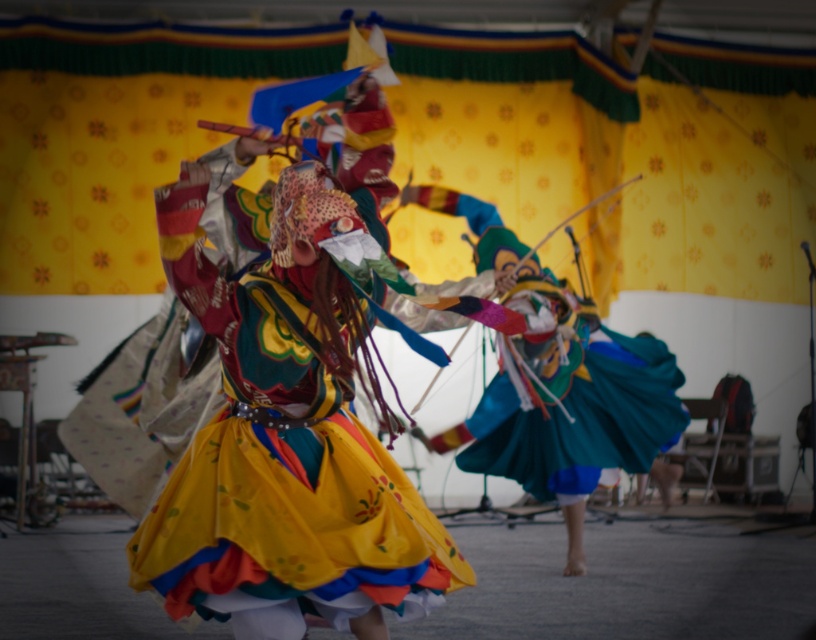
Based on the scene description, can you determine which object is positioned lower in the image between the multicolored fabric costume at center and the teal satin skirt at center?

The multicolored fabric costume at center is positioned lower than the teal satin skirt at center in the image.

Based on the scene description, which object is narrower between the multicolored fabric costume at center and the teal satin skirt at center?

The multicolored fabric costume at center is narrower than the teal satin skirt at center according to the description.

Looking at this image, you are a photographer trying to capture the vibrant costumes of the dancers. You notice the multicolored fabric costume at center and the teal satin skirt at center. Which costume should you focus on if you want to photograph the one that is more to the left?

The multicolored fabric costume at center is positioned on the left side of teal satin skirt at center, so you should focus on the multicolored fabric costume at center to capture the one more to the left.